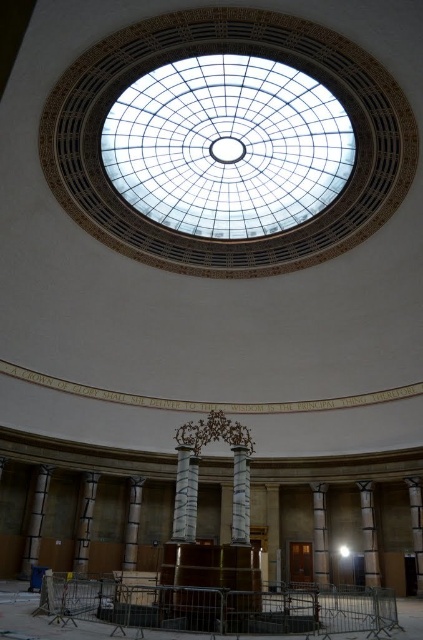
What is the height comparison between the sanded wood pillar at right and the slate stone column at center?

The sanded wood pillar at right is not as tall as the slate stone column at center.

You are standing at the entrance of the grand circular structure and want to locate the sanded concrete pillar at center. According to the coordinates provided, in which direction should you walk from your current position to find it?

The sanded concrete pillar at center is located at coordinates point (85,522). Since the coordinates are given as x and y values between 0 and 1, with (0,0) being the bottom left corner, you should walk towards the right and slightly upwards from the entrance to reach it.